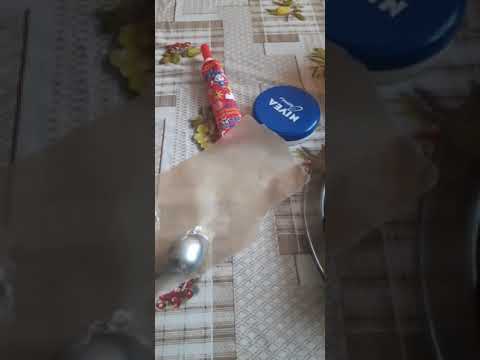
At what (x,y) coordinates should I click in order to perform the action: click on table. Please return your answer as a coordinate pair (x, y). Looking at the image, I should click on (257, 60).